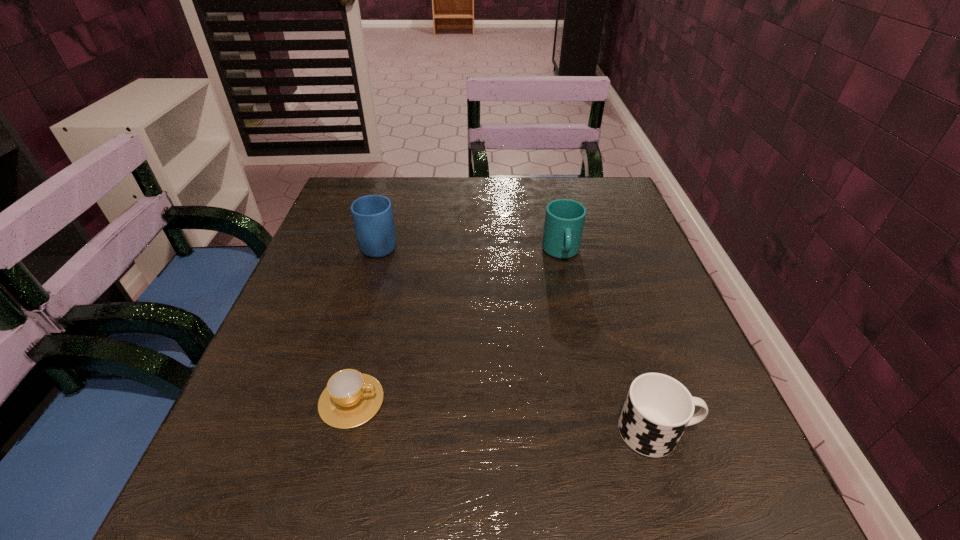
Where is `vacant space that is in between the shortest cup and the mug`? This screenshot has height=540, width=960. vacant space that is in between the shortest cup and the mug is located at coordinates (366, 322).

Identify the location of object that stands as the second closest to the third tallest object. This screenshot has width=960, height=540. (351, 398).

Choose which object is the nearest neighbor to the mug. Please provide its 2D coordinates. Your answer should be formatted as a tuple, i.e. [(x, y)], where the tuple contains the x and y coordinates of a point satisfying the conditions above.

[(351, 398)]

Identify which cup is the closest to the second shortest object. Please provide its 2D coordinates. Your answer should be formatted as a tuple, i.e. [(x, y)], where the tuple contains the x and y coordinates of a point satisfying the conditions above.

[(564, 222)]

Locate which cup is the second closest to the mug. Please provide its 2D coordinates. Your answer should be formatted as a tuple, i.e. [(x, y)], where the tuple contains the x and y coordinates of a point satisfying the conditions above.

[(564, 222)]

Find the location of a particular element. This screenshot has height=540, width=960. vacant space that satisfies the following two spatial constraints: 1. on the handle side of the tallest cup; 2. with the handle on the side of the leftmost cup is located at coordinates (595, 401).

Image resolution: width=960 pixels, height=540 pixels. In order to click on vacant region that satisfies the following two spatial constraints: 1. on the handle side of the tallest cup; 2. with the handle on the side of the leftmost cup in this screenshot , I will do `click(595, 401)`.

The width and height of the screenshot is (960, 540). Identify the location of free space that satisfies the following two spatial constraints: 1. on the handle side of the tallest cup; 2. with the handle on the side of the shortest cup. (595, 401).